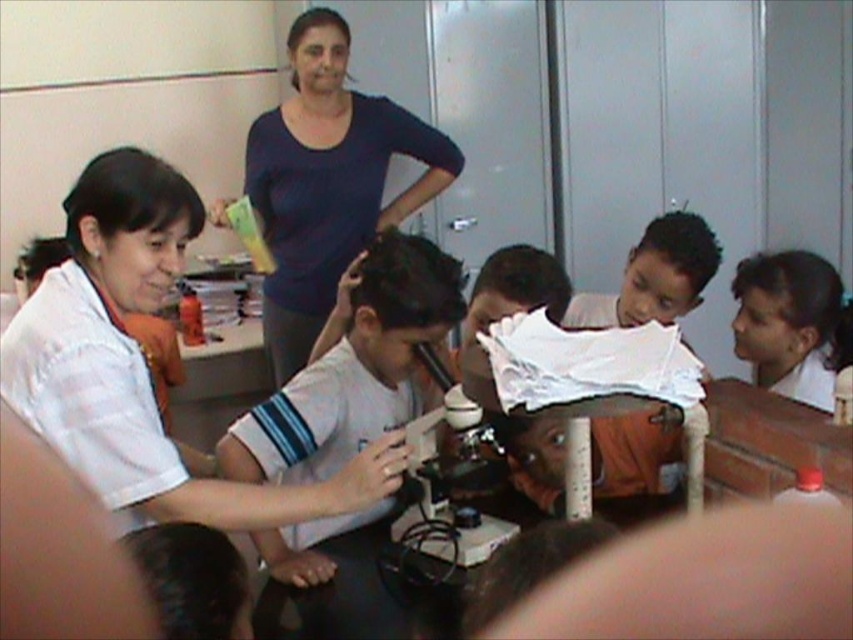
Question: Among these objects, which one is farthest from the camera?

Choices:
 (A) metallic microscope at center
 (B) black hair at upper right

Answer: (B)

Question: Considering the real-world distances, which object is farthest from the white matte shirt at left?

Choices:
 (A) dark blue shirt at upper center
 (B) black hair at upper right
 (C) metallic microscope at center

Answer: (B)

Question: Does dark blue shirt at upper center have a smaller size compared to black hair at upper right?

Choices:
 (A) yes
 (B) no

Answer: (B)

Question: Is white matte shirt at left above black hair at upper right?

Choices:
 (A) yes
 (B) no

Answer: (B)

Question: Based on their relative distances, which object is farther from the dark blue shirt at upper center?

Choices:
 (A) white matte shirt at left
 (B) black hair at upper right
 (C) metallic microscope at center

Answer: (B)

Question: Observing the image, what is the correct spatial positioning of white matte shirt at center in reference to dark blue shirt at upper center?

Choices:
 (A) below
 (B) above

Answer: (A)